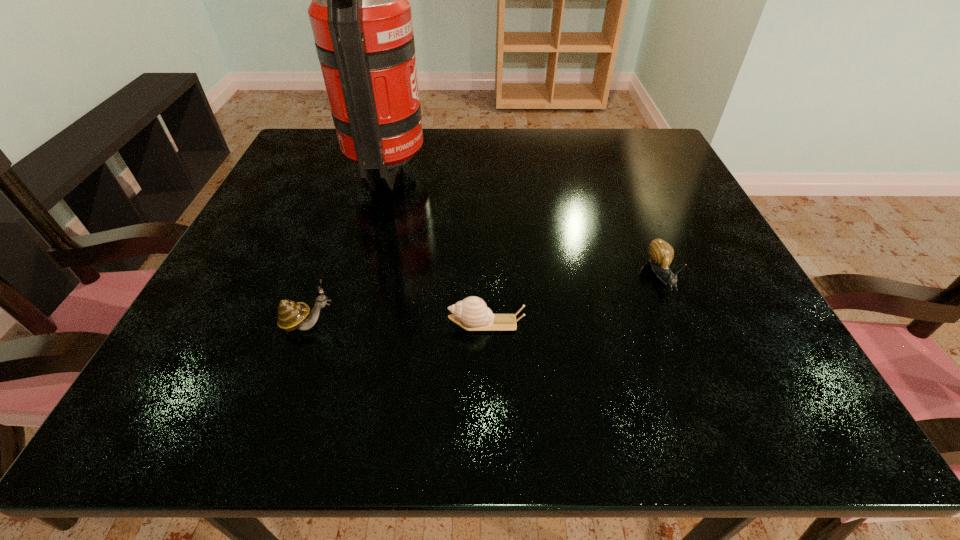
This screenshot has height=540, width=960. I want to click on vacant area at the left edge, so click(x=206, y=359).

This screenshot has width=960, height=540. I want to click on free space at the right edge of the desktop, so click(x=696, y=220).

The image size is (960, 540). In order to click on vacant space at the far left corner of the desktop in this screenshot , I will do `click(321, 148)`.

You are a GUI agent. You are given a task and a screenshot of the screen. Output one action in this format:
    pyautogui.click(x=<x>, y=<y>)
    Task: Click on the free space at the near left corner
    Image resolution: width=960 pixels, height=540 pixels.
    Given the screenshot: What is the action you would take?
    pyautogui.click(x=179, y=406)

This screenshot has width=960, height=540. I want to click on blank space at the near right corner, so click(x=814, y=399).

You are a GUI agent. You are given a task and a screenshot of the screen. Output one action in this format:
    pyautogui.click(x=<x>, y=<y>)
    Task: Click on the vacant area between the fire extinguisher and the leftmost escargot
    
    Given the screenshot: What is the action you would take?
    348,245

This screenshot has width=960, height=540. Identify the location of free area in between the third object from left to right and the second tallest object. (397, 324).

Find the location of a particular element. free point between the third object from left to right and the leftmost escargot is located at coordinates (397, 324).

Locate an element on the screen. This screenshot has height=540, width=960. vacant point located between the second tallest object and the second object from right to left is located at coordinates (397, 324).

In order to click on free space between the leftmost escargot and the second escargot from left to right in this screenshot , I will do `click(397, 324)`.